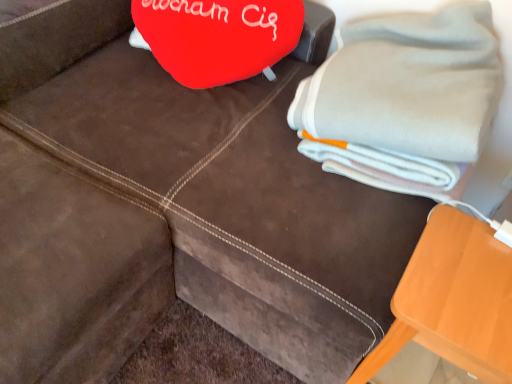
Question: Does point (307, 79) appear closer or farther from the camera than point (430, 233)?

Choices:
 (A) closer
 (B) farther

Answer: (B)

Question: From a real-world perspective, is gray cotton bath towel at upper right physically located above or below orange wood table at lower right?

Choices:
 (A) above
 (B) below

Answer: (A)

Question: Based on their positions, is gray cotton bath towel at upper right located to the left or right of orange wood table at lower right?

Choices:
 (A) right
 (B) left

Answer: (B)

Question: From the image's perspective, is orange wood table at lower right located above or below gray cotton bath towel at upper right?

Choices:
 (A) above
 (B) below

Answer: (B)

Question: Looking at the image, does orange wood table at lower right seem bigger or smaller compared to gray cotton bath towel at upper right?

Choices:
 (A) big
 (B) small

Answer: (B)

Question: Visually, is orange wood table at lower right positioned to the left or to the right of gray cotton bath towel at upper right?

Choices:
 (A) left
 (B) right

Answer: (B)

Question: Is point (382, 342) positioned closer to the camera than point (314, 124)?

Choices:
 (A) closer
 (B) farther

Answer: (A)